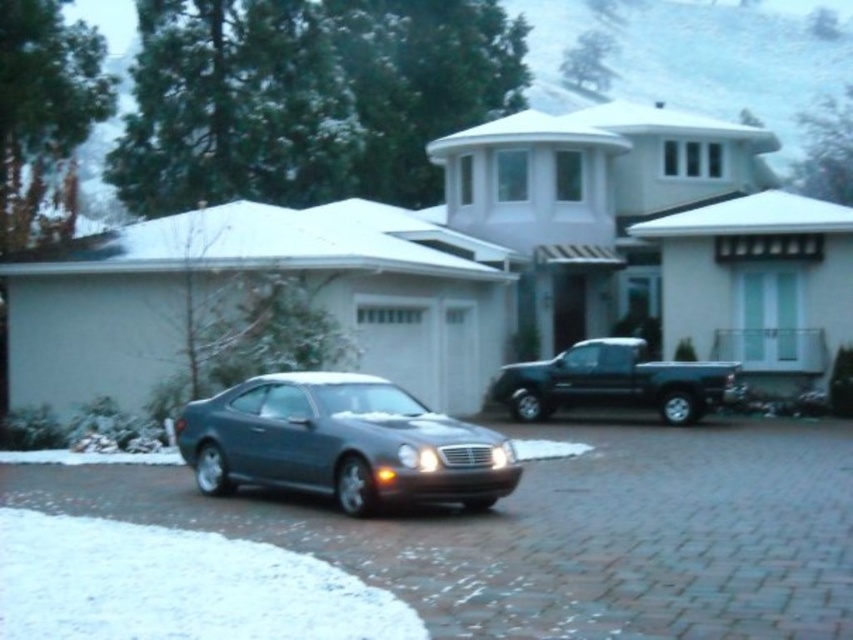
Does satin silver coupe at center have a greater height compared to matte black truck at center?

Incorrect, satin silver coupe at center's height is not larger of matte black truck at center's.

Is satin silver coupe at center further to camera compared to matte black truck at center?

No, it is not.

Measure the distance between satin silver coupe at center and camera.

satin silver coupe at center is 10.46 meters away from camera.

At what (x,y) coordinates should I click in order to perform the action: click on satin silver coupe at center. Please return your answer as a coordinate pair (x, y). Looking at the image, I should click on (341, 444).

Is satin silver car at center positioned before matte black truck at center?

Yes.

Which of these two, satin silver car at center or matte black truck at center, stands shorter?

Standing shorter between the two is satin silver car at center.

Does point (440, 572) come in front of point (607, 380)?

Yes, point (440, 572) is in front of point (607, 380).

Where is `satin silver car at center`? This screenshot has height=640, width=853. satin silver car at center is located at coordinates (564, 531).

Does point (715, 532) come in front of point (184, 426)?

That is True.

Is point (53, 488) positioned after point (218, 438)?

Yes, it is.

Is point (630, 452) positioned after point (412, 472)?

Yes, point (630, 452) is behind point (412, 472).

This screenshot has height=640, width=853. In order to click on satin silver car at center in this screenshot , I will do `click(564, 531)`.